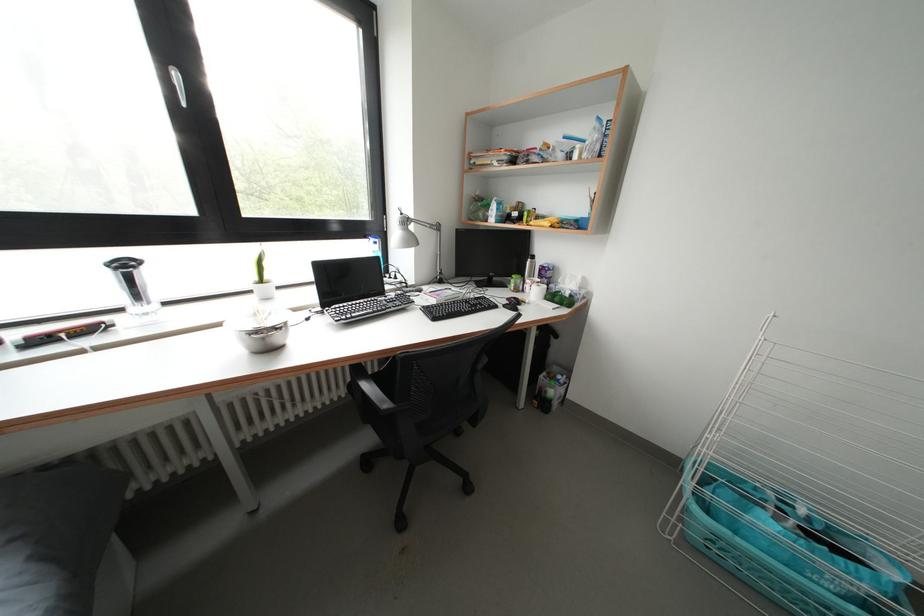
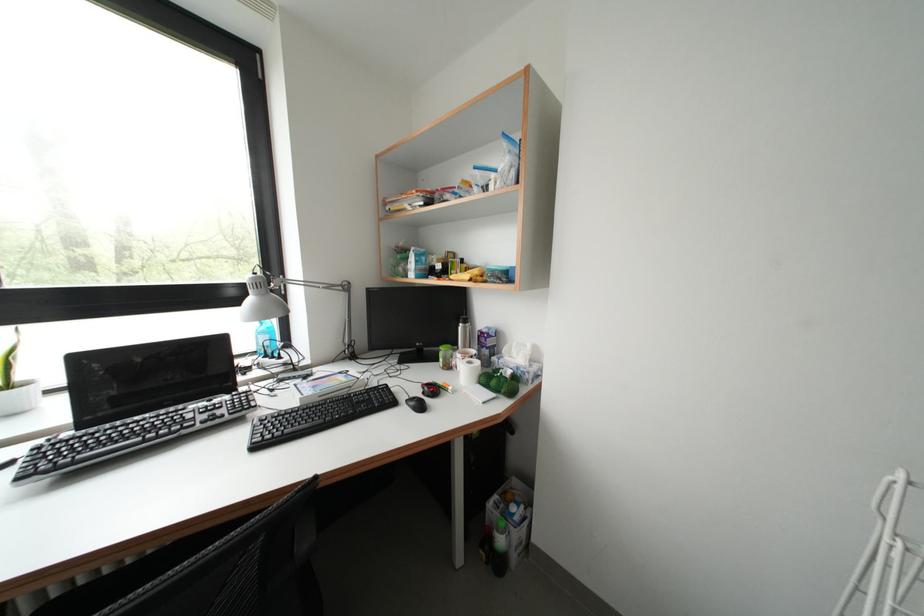
The images are taken continuously from a first-person perspective. In which direction are you moving?

The cameraman walked toward right, forward.